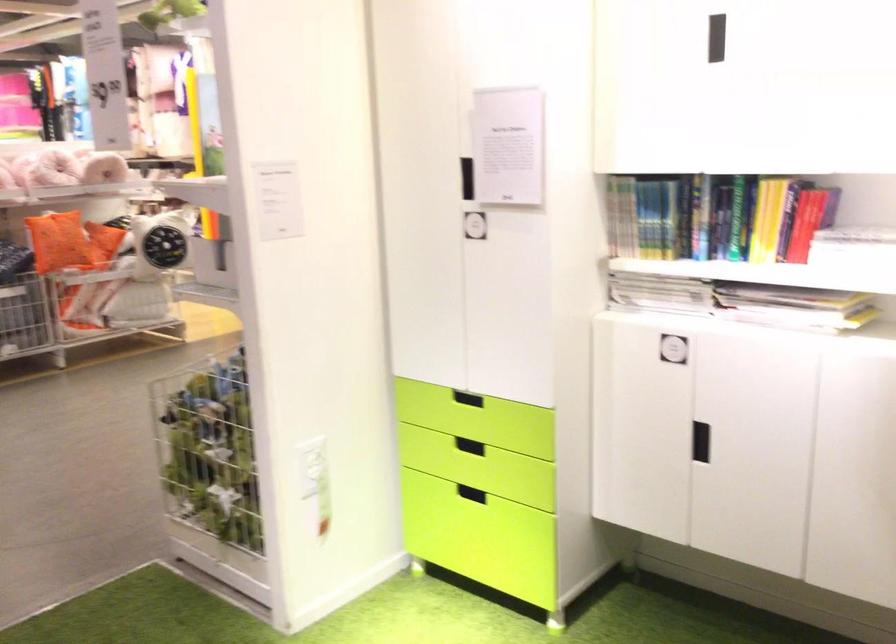
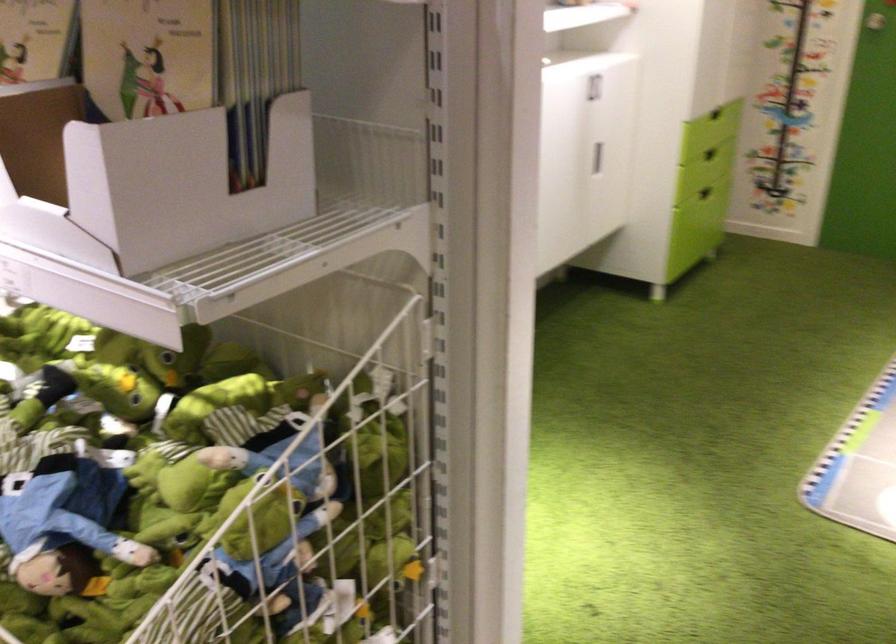
Question: I am providing you with two images of the same scene from different viewpoints. After the viewpoint changes to image2, which objects are now occluded?

Choices:
 (A) black cabinet handle
 (B) ceramic toothbrush holder
 (C) white cabinet handle
 (D) thin book

Answer: (A)